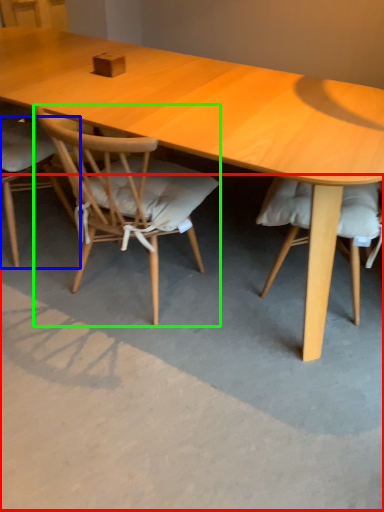
Question: Which object is the farthest from concrete (highlighted by a red box)? Choose among these: chair (highlighted by a blue box) or chair (highlighted by a green box).

Choices:
 (A) chair
 (B) chair

Answer: (A)